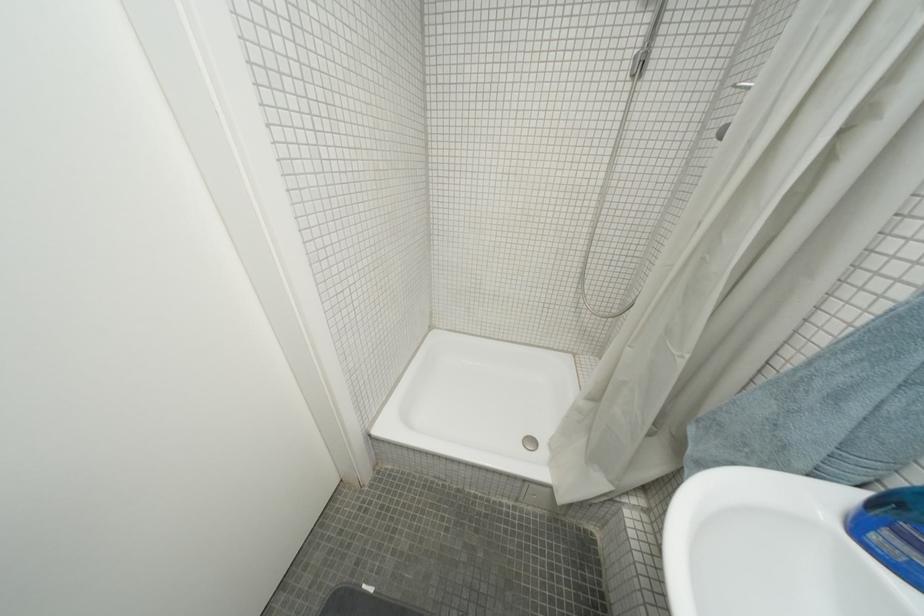
Locate an element on the screen. silver shower head is located at coordinates (743, 86).